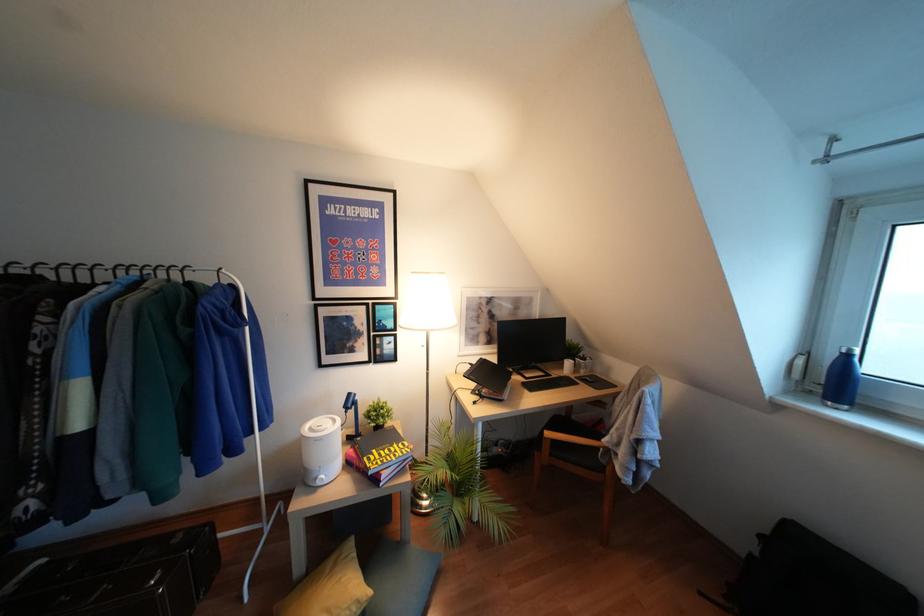
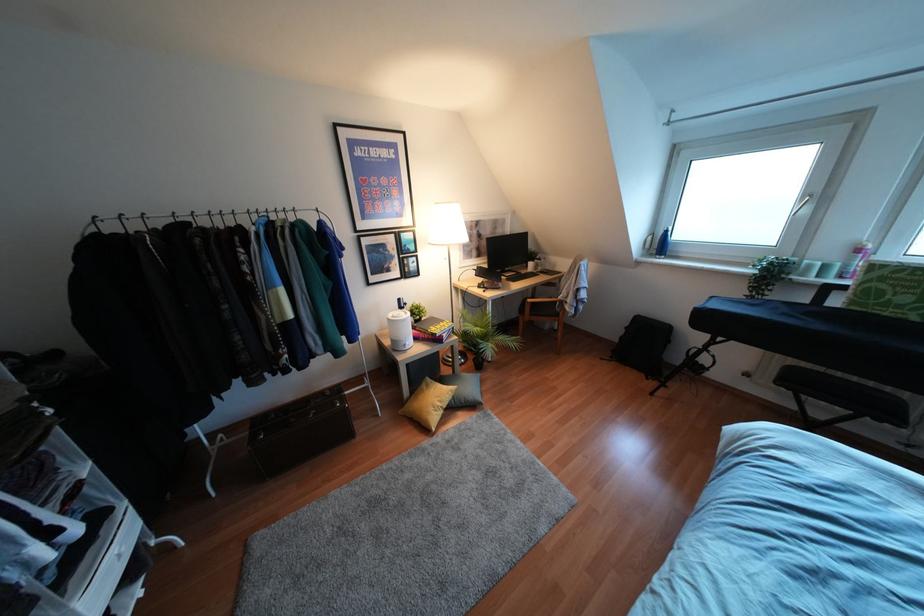
Find the pixel in the second image that matches point (833, 379) in the first image.

(660, 245)